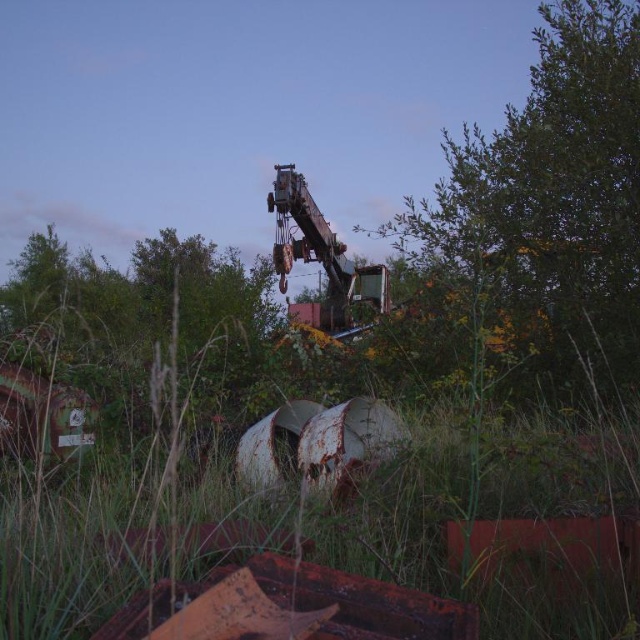
Question: Does green grass at center have a greater width compared to green leafy tree at upper right?

Choices:
 (A) no
 (B) yes

Answer: (B)

Question: Which point appears closest to the camera in this image?

Choices:
 (A) (58, 518)
 (B) (556, 342)

Answer: (A)

Question: Considering the relative positions of green leafy tree at upper right and green matte tree at center in the image provided, where is green leafy tree at upper right located with respect to green matte tree at center?

Choices:
 (A) left
 (B) right

Answer: (B)

Question: Which object appears farthest from the camera in this image?

Choices:
 (A) green matte tree at center
 (B) green leafy tree at upper right
 (C) green grass at center

Answer: (A)

Question: Is green grass at center wider than green leafy tree at upper right?

Choices:
 (A) no
 (B) yes

Answer: (B)

Question: Estimate the real-world distances between objects in this image. Which object is closer to the green grass at center?

Choices:
 (A) green leafy tree at upper right
 (B) green matte tree at center

Answer: (A)